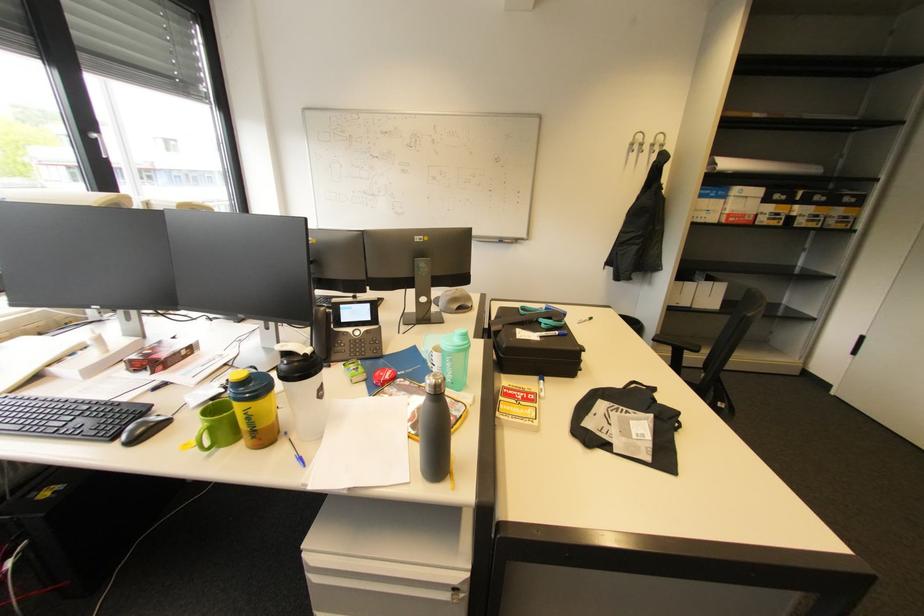
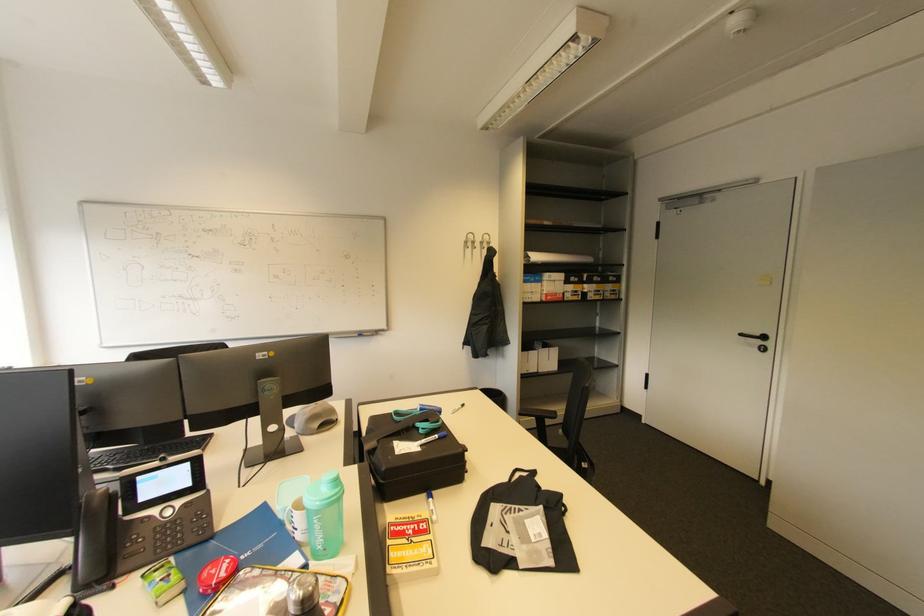
Locate, in the second image, the point that corresponds to point 453,361 in the first image.

(320, 522)